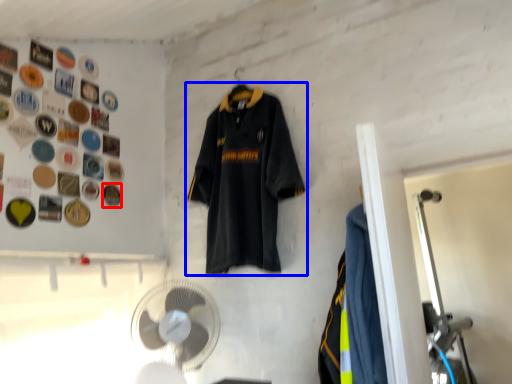
Question: Which point is further to the camera, button (highlighted by a red box) or sports uniform (highlighted by a blue box)?

Choices:
 (A) button
 (B) sports uniform

Answer: (A)